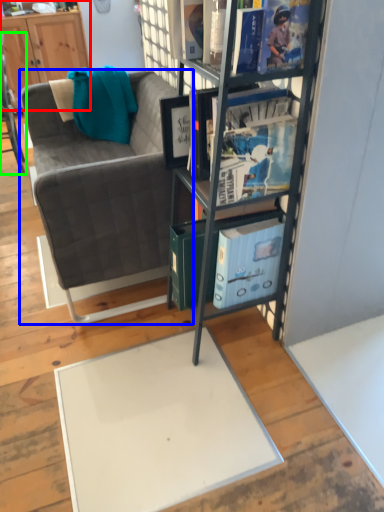
Question: Considering the real-world distances, which object is closest to cabinetry (highlighted by a red box)? studio couch (highlighted by a blue box) or chair (highlighted by a green box).

Choices:
 (A) studio couch
 (B) chair

Answer: (B)